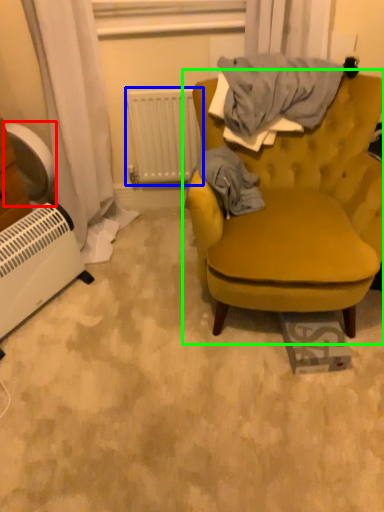
Question: Based on their relative distances, which object is nearer to fan (highlighted by a red box)? Choose from radiator (highlighted by a blue box) and chair (highlighted by a green box).

Choices:
 (A) radiator
 (B) chair

Answer: (A)